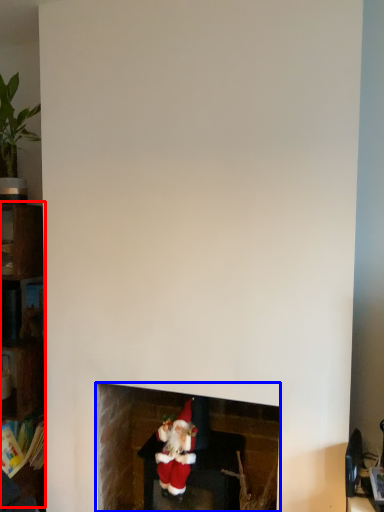
Question: Which point is further to the camera, shelf (highlighted by a red box) or fireplace (highlighted by a blue box)?

Choices:
 (A) shelf
 (B) fireplace

Answer: (A)